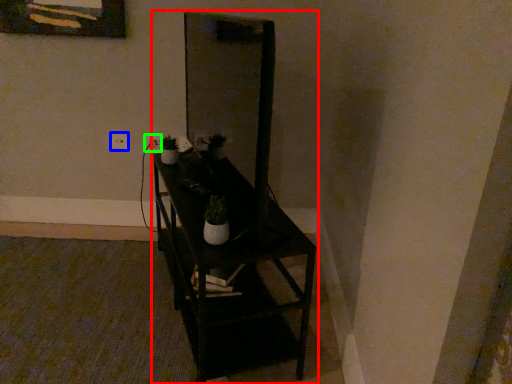
Question: Which object is the farthest from furniture (highlighted by a red box)? Choose among these: electric outlet (highlighted by a blue box) or electric outlet (highlighted by a green box).

Choices:
 (A) electric outlet
 (B) electric outlet

Answer: (A)